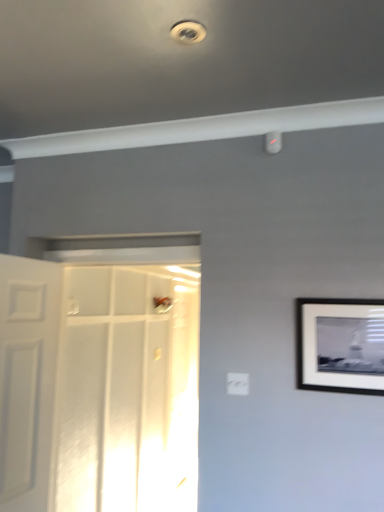
Question: Is white plastic electric outlet at center directly adjacent to white plastic droplight at upper center, the second droplight in the bottom-to-top sequence?

Choices:
 (A) no
 (B) yes

Answer: (A)

Question: From the image's perspective, would you say white plastic electric outlet at center is positioned over white plastic droplight at upper center, the 2th droplight from the right?

Choices:
 (A) no
 (B) yes

Answer: (A)

Question: Does white plastic electric outlet at center appear on the right side of white plastic droplight at upper center, arranged as the first droplight when viewed from the front?

Choices:
 (A) no
 (B) yes

Answer: (B)

Question: Does white plastic electric outlet at center have a lesser height compared to white plastic droplight at upper center, which is counted as the first droplight, starting from the top?

Choices:
 (A) no
 (B) yes

Answer: (A)

Question: Is white plastic electric outlet at center far from white plastic droplight at upper center, the second droplight in the bottom-to-top sequence?

Choices:
 (A) yes
 (B) no

Answer: (A)

Question: From a real-world perspective, relative to white plastic droplight at upper right, the second droplight positioned from the front, is white glossy door at center, the second door positioned from the left, vertically above or below?

Choices:
 (A) above
 (B) below

Answer: (B)

Question: Based on their positions, is white glossy door at center, the 1th door viewed from the right, located to the left or right of white plastic droplight at upper right, the first droplight in the bottom-to-top sequence?

Choices:
 (A) left
 (B) right

Answer: (A)

Question: Choose the correct answer: Is white glossy door at center, the second door positioned from the left, inside white plastic droplight at upper right, which appears as the second droplight when viewed from the top, or outside it?

Choices:
 (A) inside
 (B) outside

Answer: (B)

Question: Looking at their shapes, would you say white glossy door at center, the 1th door viewed from the right, is wider or thinner than white plastic droplight at upper right, the second droplight positioned from the front?

Choices:
 (A) wide
 (B) thin

Answer: (A)

Question: From a real-world perspective, is white matte door at left, which ranks as the second door in right-to-left order, positioned above or below white plastic droplight at upper center, the 2th droplight viewed from the back?

Choices:
 (A) below
 (B) above

Answer: (A)

Question: From the image's perspective, is white matte door at left, the first door viewed from the left, above or below white plastic droplight at upper center, the first droplight in the left-to-right sequence?

Choices:
 (A) above
 (B) below

Answer: (B)

Question: Is white matte door at left, the first door viewed from the left, taller or shorter than white plastic droplight at upper center, which is counted as the first droplight, starting from the top?

Choices:
 (A) tall
 (B) short

Answer: (A)

Question: Is white matte door at left, which ranks as the second door in right-to-left order, situated inside white plastic droplight at upper center, the 2th droplight viewed from the back, or outside?

Choices:
 (A) inside
 (B) outside

Answer: (B)

Question: Considering the positions of white plastic droplight at upper center, which is counted as the first droplight, starting from the top, and white plastic electric outlet at center in the image, is white plastic droplight at upper center, which is counted as the first droplight, starting from the top, bigger or smaller than white plastic electric outlet at center?

Choices:
 (A) big
 (B) small

Answer: (A)

Question: In terms of width, does white plastic droplight at upper center, the 2th droplight from the right, look wider or thinner when compared to white plastic electric outlet at center?

Choices:
 (A) wide
 (B) thin

Answer: (A)